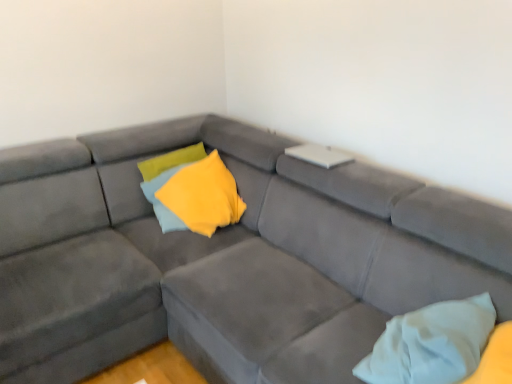
The height and width of the screenshot is (384, 512). Describe the element at coordinates (226, 259) in the screenshot. I see `suede gray couch at center` at that location.

Where is `suede gray couch at center`? suede gray couch at center is located at coordinates (226, 259).

Considering the points (234, 198) and (13, 273), which point is behind, point (234, 198) or point (13, 273)?

The point (234, 198) is farther.

Considering the sizes of objects yellow soft fabric pillow at center, positioned as the second pillow in bottom-to-top order, and suede gray couch at center in the image provided, who is taller, yellow soft fabric pillow at center, positioned as the second pillow in bottom-to-top order, or suede gray couch at center?

With more height is suede gray couch at center.

Is yellow soft fabric pillow at center, the first pillow from the back, turned away from suede gray couch at center?

Yes, suede gray couch at center is at the back of yellow soft fabric pillow at center, the first pillow from the back.

From a real-world perspective, relative to suede gray couch at center, is yellow soft fabric pillow at center, the first pillow when ordered from top to bottom, vertically above or below?

yellow soft fabric pillow at center, the first pillow when ordered from top to bottom, is above suede gray couch at center.

From a real-world perspective, who is located lower, white soft pillow at lower right, placed as the second pillow when sorted from left to right, or yellow soft fabric pillow at center, which is the 2th pillow in front-to-back order?

white soft pillow at lower right, placed as the second pillow when sorted from left to right, from a real-world perspective.

Is white soft pillow at lower right, arranged as the 1th pillow when viewed from the right, inside the boundaries of yellow soft fabric pillow at center, the first pillow from the left, or outside?

white soft pillow at lower right, arranged as the 1th pillow when viewed from the right, exists outside the volume of yellow soft fabric pillow at center, the first pillow from the left.

At what (x,y) coordinates should I click in order to perform the action: click on pillow that is on the right side of yellow soft fabric pillow at center, which appears as the second pillow when viewed from the right. Please return your answer as a coordinate pair (x, y). This screenshot has height=384, width=512. Looking at the image, I should click on (431, 343).

Is white soft pillow at lower right, placed as the second pillow when sorted from left to right, facing towards yellow soft fabric pillow at center, the first pillow when ordered from top to bottom?

Yes, white soft pillow at lower right, placed as the second pillow when sorted from left to right, is turned towards yellow soft fabric pillow at center, the first pillow when ordered from top to bottom.

How different are the orientations of suede gray couch at center and yellow soft fabric pillow at center, the first pillow from the left, in degrees?

There is a 90-degree angle between the facing directions of suede gray couch at center and yellow soft fabric pillow at center, the first pillow from the left.

Which object is closer to the camera, suede gray couch at center or yellow soft fabric pillow at center, the first pillow from the left?

Positioned in front is suede gray couch at center.

Based on their positions, is suede gray couch at center located to the left or right of yellow soft fabric pillow at center, which appears as the second pillow when viewed from the right?

suede gray couch at center is positioned on yellow soft fabric pillow at center, which appears as the second pillow when viewed from the right,'s right side.

Between suede gray couch at center and yellow soft fabric pillow at center, the first pillow from the left, which one has more height?

suede gray couch at center.

Which object is further away from the camera, white soft pillow at lower right, which is the first pillow from front to back, or suede gray couch at center?

white soft pillow at lower right, which is the first pillow from front to back, is further from the camera.

In terms of width, does white soft pillow at lower right, the 2th pillow viewed from the back, look wider or thinner when compared to suede gray couch at center?

white soft pillow at lower right, the 2th pillow viewed from the back, is thinner than suede gray couch at center.

Are white soft pillow at lower right, acting as the second pillow starting from the top, and suede gray couch at center making contact?

No, white soft pillow at lower right, acting as the second pillow starting from the top, is not beside suede gray couch at center.

From the image's perspective, is white soft pillow at lower right, the 2th pillow viewed from the back, under suede gray couch at center?

Yes.

From the image's perspective, is yellow soft fabric pillow at center, which is the 2th pillow in front-to-back order, located above white soft pillow at lower right, arranged as the 1th pillow when viewed from the right?

Yes, from the image's perspective, yellow soft fabric pillow at center, which is the 2th pillow in front-to-back order, is on top of white soft pillow at lower right, arranged as the 1th pillow when viewed from the right.

Consider the image. Is yellow soft fabric pillow at center, the first pillow from the left, bigger than white soft pillow at lower right, placed as the second pillow when sorted from left to right?

Yes.

Which is more to the right, yellow soft fabric pillow at center, which is the 2th pillow in front-to-back order, or white soft pillow at lower right, arranged as the 1th pillow when viewed from the right?

From the viewer's perspective, white soft pillow at lower right, arranged as the 1th pillow when viewed from the right, appears more on the right side.

Is suede gray couch at center located outside white soft pillow at lower right, placed as the second pillow when sorted from left to right?

Absolutely, suede gray couch at center is external to white soft pillow at lower right, placed as the second pillow when sorted from left to right.

From the image's perspective, is suede gray couch at center on top of white soft pillow at lower right, which is the first pillow from front to back?

Yes, from the image's perspective, suede gray couch at center is on top of white soft pillow at lower right, which is the first pillow from front to back.

Does suede gray couch at center have a lesser width compared to white soft pillow at lower right, the first pillow from the bottom?

No.

Where is `studio couch on the right side of yellow soft fabric pillow at center, the first pillow from the back`? The width and height of the screenshot is (512, 384). studio couch on the right side of yellow soft fabric pillow at center, the first pillow from the back is located at coordinates (226, 259).

Locate an element on the screen. pillow that appears behind the white soft pillow at lower right, acting as the second pillow starting from the top is located at coordinates tap(195, 194).

Looking at the image, which one is located closer to yellow soft fabric pillow at center, which appears as the second pillow when viewed from the right, white soft pillow at lower right, which is the first pillow from front to back, or suede gray couch at center?

Based on the image, suede gray couch at center appears to be nearer to yellow soft fabric pillow at center, which appears as the second pillow when viewed from the right.

Looking at the image, which one is located further to white soft pillow at lower right, the first pillow from the bottom, yellow soft fabric pillow at center, which appears as the second pillow when viewed from the right, or suede gray couch at center?

yellow soft fabric pillow at center, which appears as the second pillow when viewed from the right.

Based on their spatial positions, is white soft pillow at lower right, which is the first pillow from front to back, or yellow soft fabric pillow at center, which is the 2th pillow in front-to-back order, closer to suede gray couch at center?

yellow soft fabric pillow at center, which is the 2th pillow in front-to-back order, lies closer to suede gray couch at center than the other object.

Considering their positions, is suede gray couch at center positioned closer to yellow soft fabric pillow at center, the first pillow when ordered from top to bottom, than white soft pillow at lower right, the first pillow from the bottom?

The object closer to yellow soft fabric pillow at center, the first pillow when ordered from top to bottom, is suede gray couch at center.

Considering their positions, is suede gray couch at center positioned closer to white soft pillow at lower right, the 2th pillow viewed from the back, than yellow soft fabric pillow at center, the first pillow from the back?

suede gray couch at center.

Estimate the real-world distances between objects in this image. Which object is further from suede gray couch at center, yellow soft fabric pillow at center, positioned as the second pillow in bottom-to-top order, or white soft pillow at lower right, placed as the second pillow when sorted from left to right?

Based on the image, white soft pillow at lower right, placed as the second pillow when sorted from left to right, appears to be further to suede gray couch at center.

Identify the location of pillow between suede gray couch at center and yellow soft fabric pillow at center, the first pillow from the left, in the front-back direction. (431, 343).